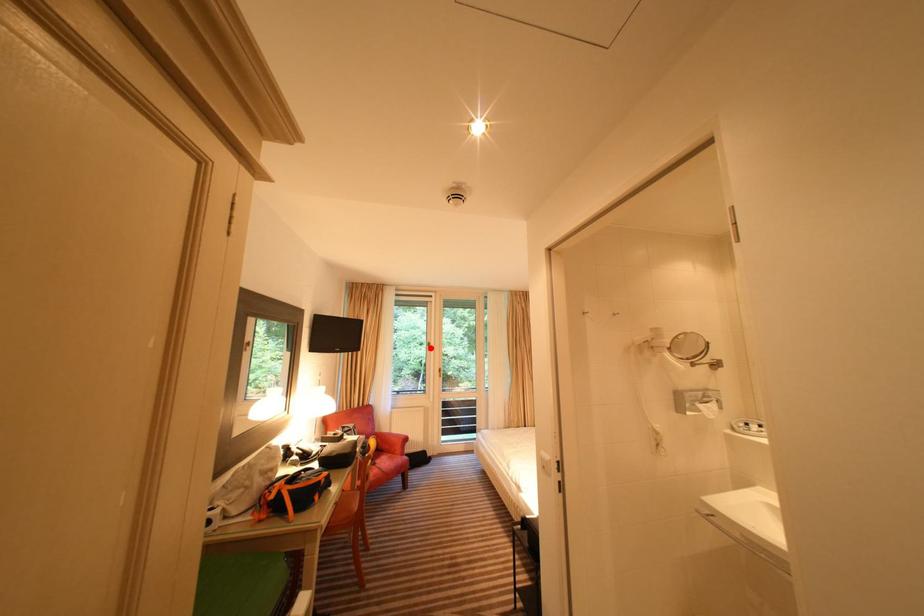
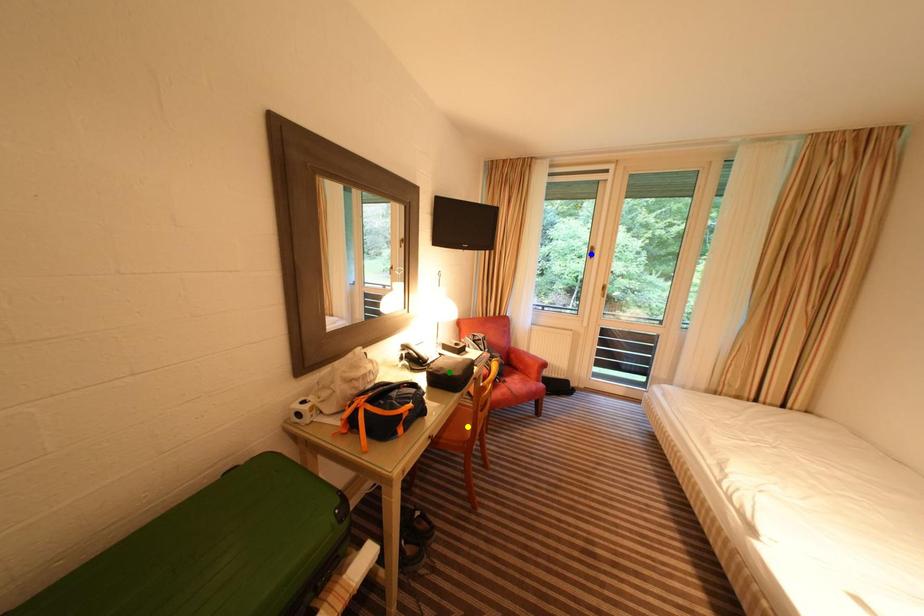
Question: I am providing you with two images of the same scene from different viewpoints. A red point is marked on the first image. You are given multiple points on the second image. In image 2, which mark is for the same physical point as the one in image 1?

Choices:
 (A) green point
 (B) yellow point
 (C) blue point

Answer: (C)